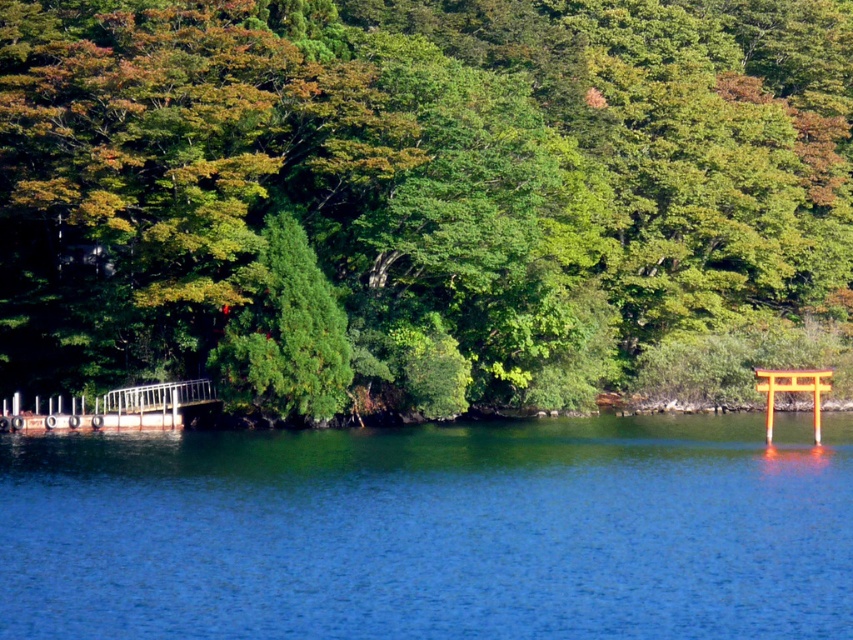
Is rusty metal dock at lower left taller than orange glossy torii gate at right?

No, rusty metal dock at lower left is not taller than orange glossy torii gate at right.

Is point (189, 380) positioned in front of point (772, 394)?

No.

The width and height of the screenshot is (853, 640). I want to click on rusty metal dock at lower left, so click(x=109, y=408).

Who is lower down, green leafy tree at center or orange glossy torii gate at right?

orange glossy torii gate at right is below.

Is point (451, 376) behind point (769, 401)?

No.

Is point (325, 132) farther from camera compared to point (770, 429)?

That is False.

The width and height of the screenshot is (853, 640). I want to click on green leafy tree at center, so click(x=415, y=192).

Between blue liquid at center and orange glossy torii gate at right, which one is positioned lower?

blue liquid at center

Between blue liquid at center and orange glossy torii gate at right, which one has less height?

With less height is blue liquid at center.

Locate an element on the screen. The width and height of the screenshot is (853, 640). blue liquid at center is located at coordinates (433, 531).

Image resolution: width=853 pixels, height=640 pixels. In order to click on blue liquid at center in this screenshot , I will do `click(433, 531)`.